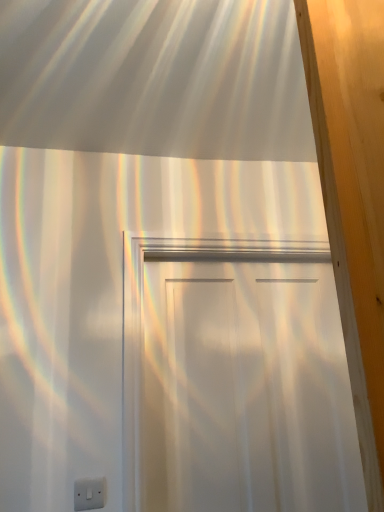
Question: Is white plastic electric outlet at lower left in front of or behind white matte door at center in the image?

Choices:
 (A) front
 (B) behind

Answer: (A)

Question: In terms of width, does white plastic electric outlet at lower left look wider or thinner when compared to white matte door at center?

Choices:
 (A) wide
 (B) thin

Answer: (B)

Question: Visually, is white plastic electric outlet at lower left positioned to the left or to the right of white matte door at center?

Choices:
 (A) right
 (B) left

Answer: (B)

Question: Is white matte door at center inside the boundaries of white plastic electric outlet at lower left, or outside?

Choices:
 (A) inside
 (B) outside

Answer: (B)

Question: In terms of width, does white matte door at center look wider or thinner when compared to white plastic electric outlet at lower left?

Choices:
 (A) thin
 (B) wide

Answer: (B)

Question: Considering the positions of point (284, 348) and point (84, 488), is point (284, 348) closer or farther from the camera than point (84, 488)?

Choices:
 (A) farther
 (B) closer

Answer: (A)

Question: Considering their positions, is white matte door at center located in front of or behind white plastic electric outlet at lower left?

Choices:
 (A) behind
 (B) front

Answer: (A)